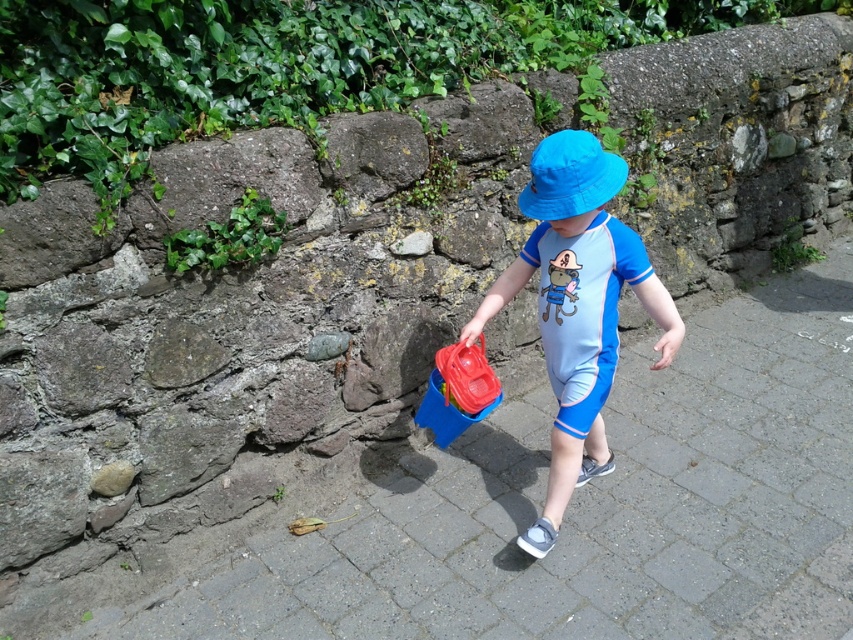
The child is walking on a path with a blue paved stone at center and wearing a blue fabric hat at center. Which object is closer to the ground?

The blue paved stone at center is closer to the ground because it is located below the blue fabric hat at center.

You are a pedestrian walking on the path and see the blue paved stone at center and the blue fabric hat at center. Which object is closer to you?

The blue paved stone at center is closer to you because it is in front of the blue fabric hat at center.